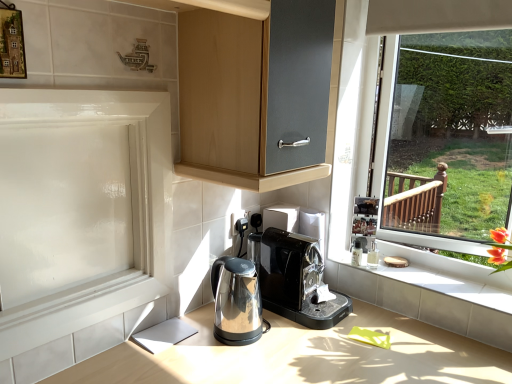
This screenshot has width=512, height=384. Describe the element at coordinates (303, 356) in the screenshot. I see `satin metallic countertop at center` at that location.

Image resolution: width=512 pixels, height=384 pixels. What are the coordinates of `satin metallic countertop at center` in the screenshot? It's located at (303, 356).

Image resolution: width=512 pixels, height=384 pixels. Describe the element at coordinates (298, 281) in the screenshot. I see `black plastic coffee machine at center, the second home appliance from the left` at that location.

At what (x,y) coordinates should I click in order to perform the action: click on stainless steel kettle at lower center, the second home appliance from the right. Please return your answer as a coordinate pair (x, y). This screenshot has height=384, width=512. Looking at the image, I should click on (236, 301).

Considering the relative sizes of white tile at lower right and white glossy screen door at left in the image provided, is white tile at lower right bigger than white glossy screen door at left?

No, white tile at lower right is not bigger than white glossy screen door at left.

Between white tile at lower right and white glossy screen door at left, which one has more height?

white glossy screen door at left.

In the scene shown: From a real-world perspective, is white tile at lower right on white glossy screen door at left?

No, from a real-world perspective, white tile at lower right is not on top of white glossy screen door at left.

From the picture: Does black plastic coffee machine at center, the second home appliance from the left, have a smaller size compared to satin metallic countertop at center?

Yes.

Between black plastic coffee machine at center, marked as the 1th home appliance in a right-to-left arrangement, and satin metallic countertop at center, which one has more height?

With more height is satin metallic countertop at center.

Locate an element on the screen. countertop below the black plastic coffee machine at center, marked as the 1th home appliance in a right-to-left arrangement (from the image's perspective) is located at coordinates click(x=303, y=356).

Can you tell me how much black plastic coffee machine at center, the second home appliance from the left, and satin metallic countertop at center differ in facing direction?

The angular difference between black plastic coffee machine at center, the second home appliance from the left, and satin metallic countertop at center is 89 degrees.

Between stainless steel kettle at lower center, the second home appliance from the right, and white tile at lower right, which one has less height?

With less height is white tile at lower right.

Do you think stainless steel kettle at lower center, placed as the first home appliance when sorted from left to right, is within white tile at lower right, or outside of it?

stainless steel kettle at lower center, placed as the first home appliance when sorted from left to right, cannot be found inside white tile at lower right.

From a real-world perspective, who is located higher, stainless steel kettle at lower center, placed as the first home appliance when sorted from left to right, or white tile at lower right?

stainless steel kettle at lower center, placed as the first home appliance when sorted from left to right.

Looking at their sizes, would you say stainless steel kettle at lower center, the second home appliance from the right, is wider or thinner than white tile at lower right?

Considering their sizes, stainless steel kettle at lower center, the second home appliance from the right, looks slimmer than white tile at lower right.

From the picture: Does satin metallic countertop at center appear on the left side of stainless steel kettle at lower center, the second home appliance from the right?

No, satin metallic countertop at center is not to the left of stainless steel kettle at lower center, the second home appliance from the right.

Which object is further away from the camera, satin metallic countertop at center or stainless steel kettle at lower center, the second home appliance from the right?

stainless steel kettle at lower center, the second home appliance from the right.

Is satin metallic countertop at center oriented towards stainless steel kettle at lower center, the second home appliance from the right?

No, satin metallic countertop at center is not aimed at stainless steel kettle at lower center, the second home appliance from the right.

Considering the relative sizes of satin metallic countertop at center and stainless steel kettle at lower center, placed as the first home appliance when sorted from left to right, in the image provided, is satin metallic countertop at center shorter than stainless steel kettle at lower center, placed as the first home appliance when sorted from left to right,?

No.

From the image's perspective, does white tile at lower right appear lower than stainless steel kettle at lower center, placed as the first home appliance when sorted from left to right?

Incorrect, from the image's perspective, white tile at lower right is higher than stainless steel kettle at lower center, placed as the first home appliance when sorted from left to right.

Is white tile at lower right thinner than stainless steel kettle at lower center, placed as the first home appliance when sorted from left to right?

In fact, white tile at lower right might be wider than stainless steel kettle at lower center, placed as the first home appliance when sorted from left to right.

Consider the image. How distant is white tile at lower right from stainless steel kettle at lower center, the second home appliance from the right?

A distance of 22.44 inches exists between white tile at lower right and stainless steel kettle at lower center, the second home appliance from the right.

Is white tile at lower right inside the boundaries of stainless steel kettle at lower center, the second home appliance from the right, or outside?

white tile at lower right is not inside stainless steel kettle at lower center, the second home appliance from the right, it's outside.

From a real-world perspective, is white glossy screen door at left positioned above or below white tile at lower right?

From a real-world perspective, white glossy screen door at left is physically above white tile at lower right.

Consider the image. Is there a large distance between white glossy screen door at left and white tile at lower right?

No, there isn't a large distance between white glossy screen door at left and white tile at lower right.

Between white glossy screen door at left and white tile at lower right, which one has more height?

white glossy screen door at left is taller.

Considering the relative positions of white glossy screen door at left and white tile at lower right in the image provided, is white glossy screen door at left behind white tile at lower right?

No, the depth of white glossy screen door at left is less than that of white tile at lower right.

Which object is thinner, white tile at lower right or black plastic coffee machine at center, marked as the 1th home appliance in a right-to-left arrangement?

With smaller width is white tile at lower right.

From a real-world perspective, which is physically below, white tile at lower right or black plastic coffee machine at center, marked as the 1th home appliance in a right-to-left arrangement?

white tile at lower right.

From the image's perspective, is white tile at lower right located beneath black plastic coffee machine at center, the second home appliance from the left?

Yes, from the image's perspective, white tile at lower right is beneath black plastic coffee machine at center, the second home appliance from the left.

Does white tile at lower right contain black plastic coffee machine at center, the second home appliance from the left?

No, black plastic coffee machine at center, the second home appliance from the left, is not surrounded by white tile at lower right.

Locate an element on the screen. The width and height of the screenshot is (512, 384). screen door in front of the white tile at lower right is located at coordinates [x=63, y=207].

What are the coordinates of `home appliance that is the 2nd object located behind the satin metallic countertop at center` in the screenshot? It's located at (298, 281).

When comparing their distances from satin metallic countertop at center, does white glossy screen door at left or white tile at lower right seem closer?

The object closer to satin metallic countertop at center is white tile at lower right.

Consider the image. Which object lies nearer to the anchor point stainless steel kettle at lower center, placed as the first home appliance when sorted from left to right, black plastic coffee machine at center, the second home appliance from the left, or white tile at lower right?

Based on the image, black plastic coffee machine at center, the second home appliance from the left, appears to be nearer to stainless steel kettle at lower center, placed as the first home appliance when sorted from left to right.

Based on their spatial positions, is black plastic coffee machine at center, the second home appliance from the left, or stainless steel kettle at lower center, placed as the first home appliance when sorted from left to right, further from satin metallic countertop at center?

stainless steel kettle at lower center, placed as the first home appliance when sorted from left to right, is positioned further to the anchor satin metallic countertop at center.

When comparing their distances from white glossy screen door at left, does satin metallic countertop at center or white tile at lower right seem closer?

The object closer to white glossy screen door at left is satin metallic countertop at center.

Looking at the image, which one is located further to white glossy screen door at left, stainless steel kettle at lower center, placed as the first home appliance when sorted from left to right, or white tile at lower right?

white tile at lower right is positioned further to the anchor white glossy screen door at left.

Which object lies nearer to the anchor point white tile at lower right, black plastic coffee machine at center, marked as the 1th home appliance in a right-to-left arrangement, or satin metallic countertop at center?

black plastic coffee machine at center, marked as the 1th home appliance in a right-to-left arrangement, is positioned closer to the anchor white tile at lower right.

Which object lies nearer to the anchor point satin metallic countertop at center, black plastic coffee machine at center, marked as the 1th home appliance in a right-to-left arrangement, or white glossy screen door at left?

Based on the image, black plastic coffee machine at center, marked as the 1th home appliance in a right-to-left arrangement, appears to be nearer to satin metallic countertop at center.

From the image, which object appears to be nearer to black plastic coffee machine at center, the second home appliance from the left, white tile at lower right or white glossy screen door at left?

white tile at lower right is positioned closer to the anchor black plastic coffee machine at center, the second home appliance from the left.

In order to click on home appliance between white glossy screen door at left and black plastic coffee machine at center, the second home appliance from the left in this screenshot , I will do `click(236, 301)`.

Identify the location of home appliance between stainless steel kettle at lower center, the second home appliance from the right, and white tile at lower right, in the horizontal direction. The height and width of the screenshot is (384, 512). (298, 281).

The width and height of the screenshot is (512, 384). I want to click on countertop between white glossy screen door at left and white tile at lower right in the horizontal direction, so click(303, 356).

Where is `home appliance that lies between black plastic coffee machine at center, the second home appliance from the left, and satin metallic countertop at center from top to bottom`? Image resolution: width=512 pixels, height=384 pixels. home appliance that lies between black plastic coffee machine at center, the second home appliance from the left, and satin metallic countertop at center from top to bottom is located at coordinates (236, 301).